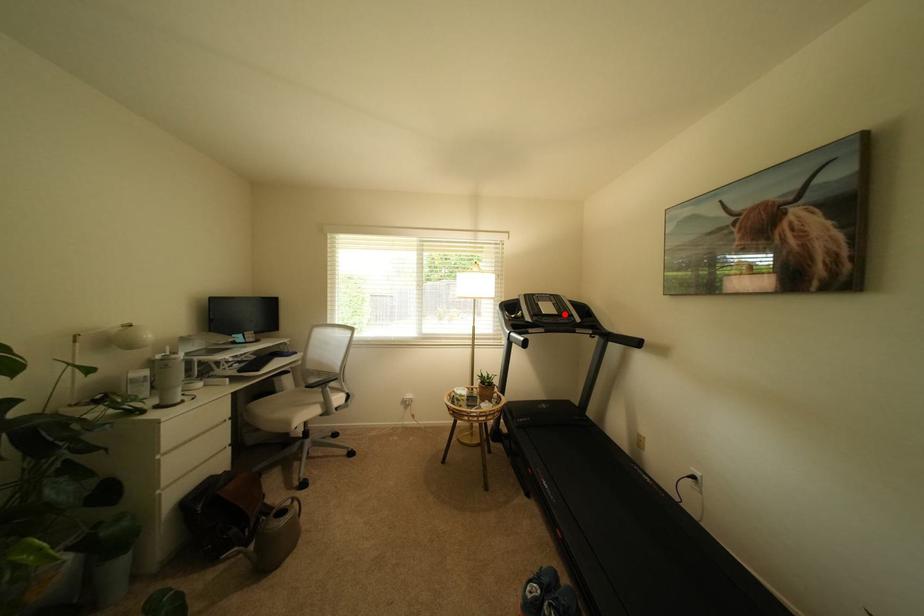
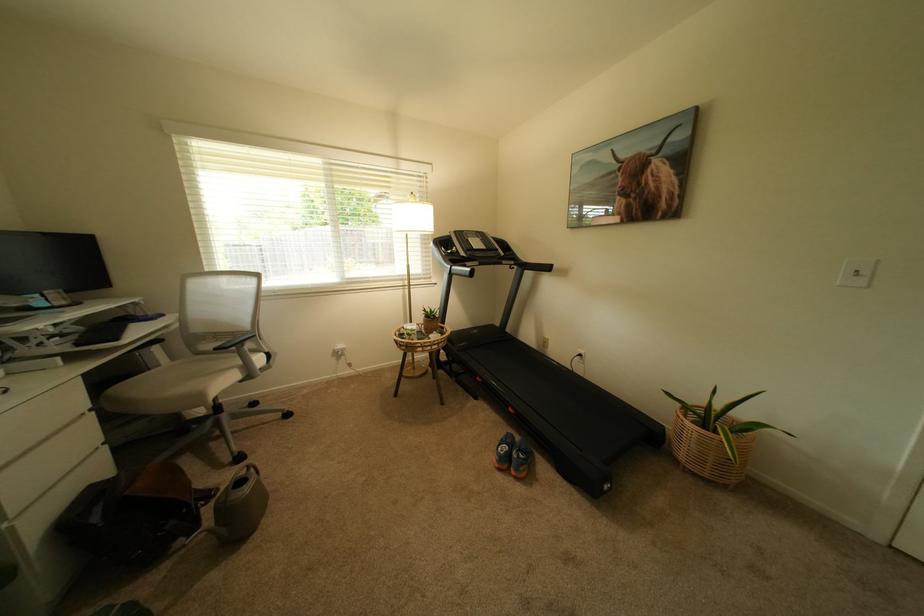
Find the pixel in the second image that matches the highlighted location in the first image.

(493, 249)